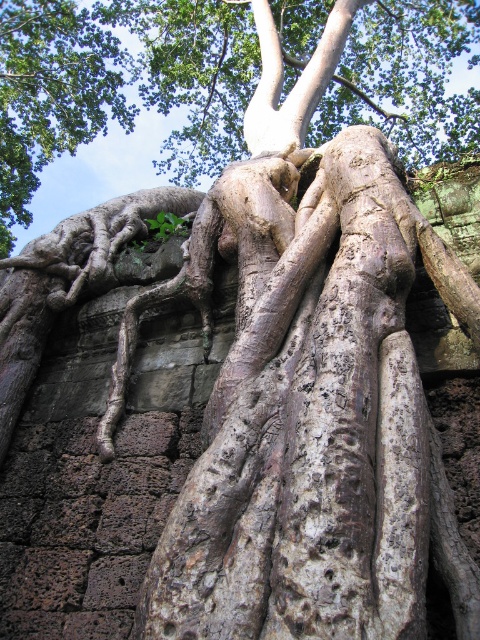
Question: Which point is closer to the camera?

Choices:
 (A) (154, 52)
 (B) (19, 16)

Answer: (A)

Question: Does rough bark roots at center have a lesser width compared to green rough bark roots at upper left?

Choices:
 (A) yes
 (B) no

Answer: (B)

Question: Which object appears closest to the camera in this image?

Choices:
 (A) rough bark roots at center
 (B) green rough bark roots at upper left

Answer: (A)

Question: Is rough bark roots at center thinner than green rough bark roots at upper left?

Choices:
 (A) yes
 (B) no

Answer: (B)

Question: Does rough bark roots at center have a larger size compared to green rough bark roots at upper left?

Choices:
 (A) no
 (B) yes

Answer: (B)

Question: Which object appears farthest from the camera in this image?

Choices:
 (A) rough bark roots at center
 (B) green rough bark roots at upper left

Answer: (B)